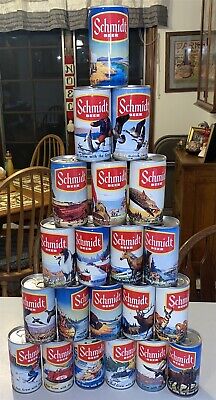
Locate an element on the screen. This screenshot has height=400, width=216. pelmet over window is located at coordinates (39, 14).